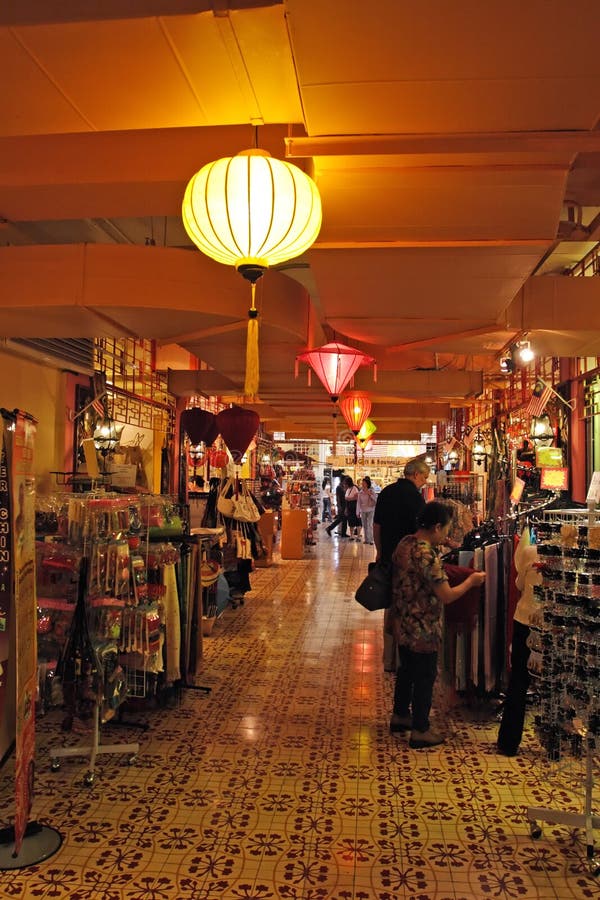
Where is `orange air ducts`? orange air ducts is located at coordinates (371, 297), (164, 317).